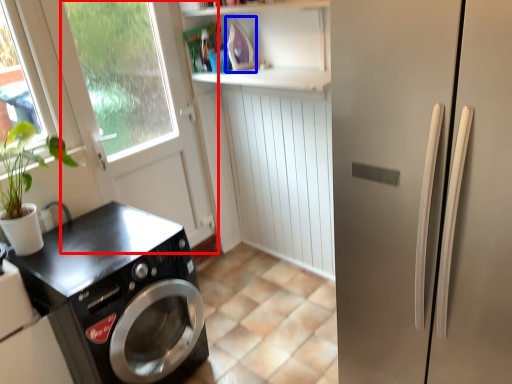
Question: Which object is further to the camera taking this photo, screen door (highlighted by a red box) or appliance (highlighted by a blue box)?

Choices:
 (A) screen door
 (B) appliance

Answer: (B)